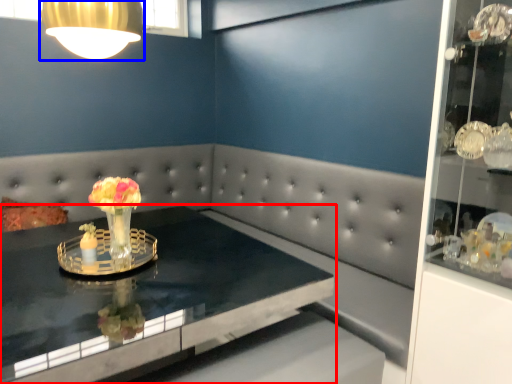
Question: Among these objects, which one is nearest to the camera, table (highlighted by a red box) or lamp (highlighted by a blue box)?

Choices:
 (A) table
 (B) lamp

Answer: (A)